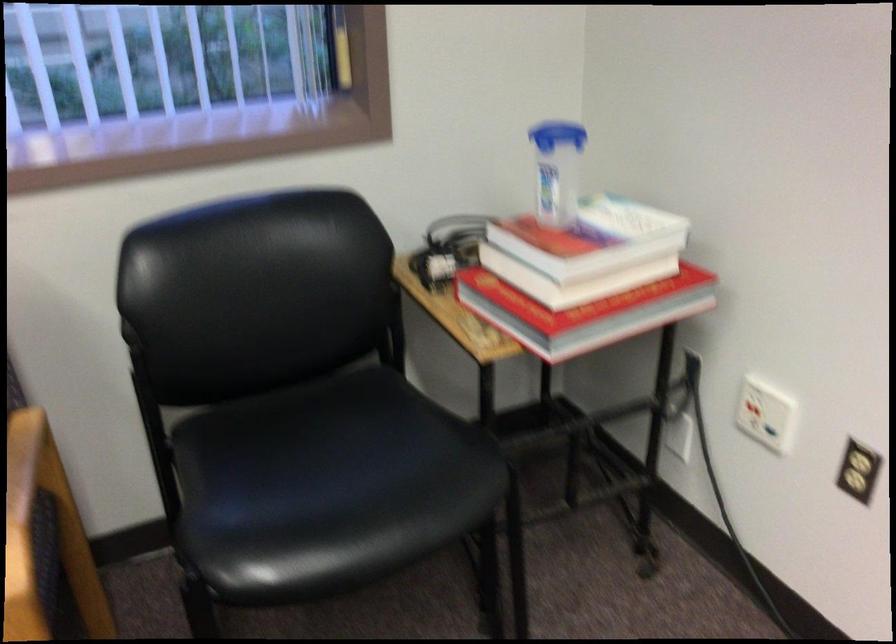
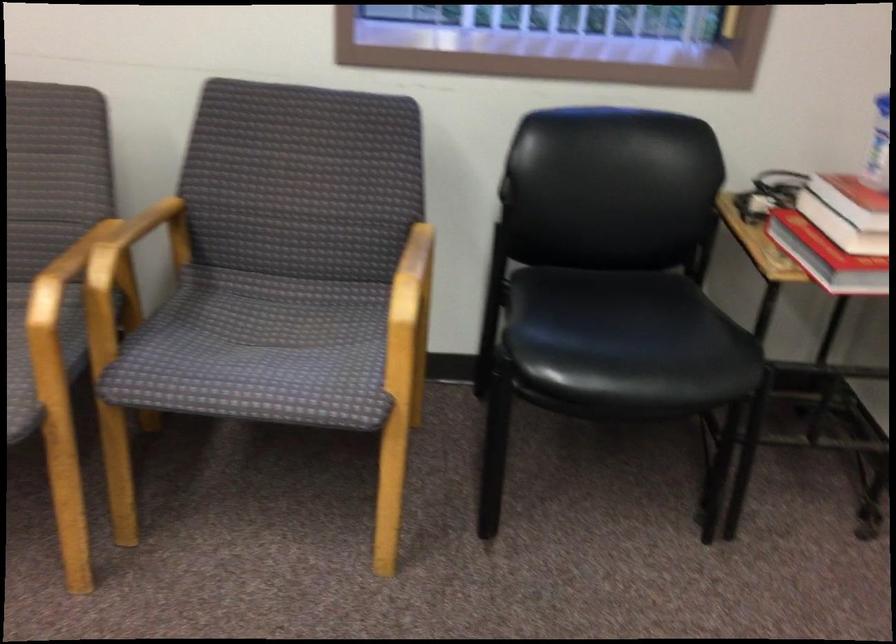
Question: Which direction would the cameraman need to move to produce the second image? Reply with the corresponding letter.

Choices:
 (A) Left
 (B) Right
 (C) Forward
 (D) Backward

Answer: (D)